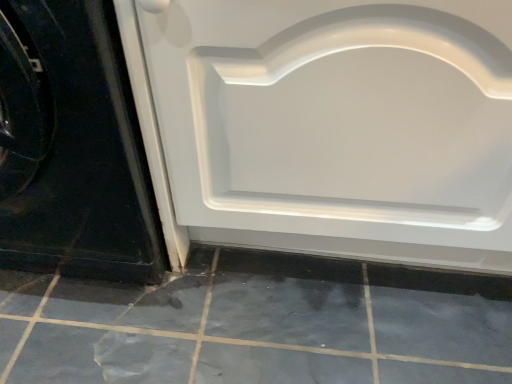
Question: Is white glossy door at center, marked as the first door in a right-to-left arrangement, far from white glossy door at lower left, which appears as the second door when viewed from the right?

Choices:
 (A) no
 (B) yes

Answer: (A)

Question: Is white glossy door at center, which appears as the 2th door when viewed from the left, taller than white glossy door at lower left, which appears as the second door when viewed from the right?

Choices:
 (A) yes
 (B) no

Answer: (A)

Question: Considering the relative positions of white glossy door at center, marked as the first door in a right-to-left arrangement, and white glossy door at lower left, which is the first door from left to right, in the image provided, is white glossy door at center, marked as the first door in a right-to-left arrangement, behind white glossy door at lower left, which is the first door from left to right,?

Choices:
 (A) yes
 (B) no

Answer: (B)

Question: Considering the relative sizes of white glossy door at center, which appears as the 2th door when viewed from the left, and white glossy door at lower left, which is the first door from left to right, in the image provided, is white glossy door at center, which appears as the 2th door when viewed from the left, wider than white glossy door at lower left, which is the first door from left to right,?

Choices:
 (A) yes
 (B) no

Answer: (B)

Question: Is white glossy door at lower left, which appears as the second door when viewed from the right, at the back of white glossy door at center, which appears as the 2th door when viewed from the left?

Choices:
 (A) yes
 (B) no

Answer: (B)

Question: Could you tell me if white glossy door at center, marked as the first door in a right-to-left arrangement, is turned towards white glossy door at lower left, which is the first door from left to right?

Choices:
 (A) no
 (B) yes

Answer: (A)

Question: Does white glossy door at center, which appears as the 2th door when viewed from the left, turn towards gray matte tile at lower center?

Choices:
 (A) no
 (B) yes

Answer: (B)

Question: Does white glossy door at center, which appears as the 2th door when viewed from the left, have a greater width compared to gray matte tile at lower center?

Choices:
 (A) yes
 (B) no

Answer: (B)

Question: Is white glossy door at center, marked as the first door in a right-to-left arrangement, in front of gray matte tile at lower center?

Choices:
 (A) yes
 (B) no

Answer: (A)

Question: Does white glossy door at center, marked as the first door in a right-to-left arrangement, have a larger size compared to gray matte tile at lower center?

Choices:
 (A) no
 (B) yes

Answer: (B)

Question: From the image's perspective, is white glossy door at center, which appears as the 2th door when viewed from the left, below gray matte tile at lower center?

Choices:
 (A) no
 (B) yes

Answer: (A)

Question: Is white glossy door at center, marked as the first door in a right-to-left arrangement, in contact with gray matte tile at lower center?

Choices:
 (A) yes
 (B) no

Answer: (B)

Question: Could you tell me if gray matte tile at lower center is facing white glossy door at center, which appears as the 2th door when viewed from the left?

Choices:
 (A) yes
 (B) no

Answer: (B)